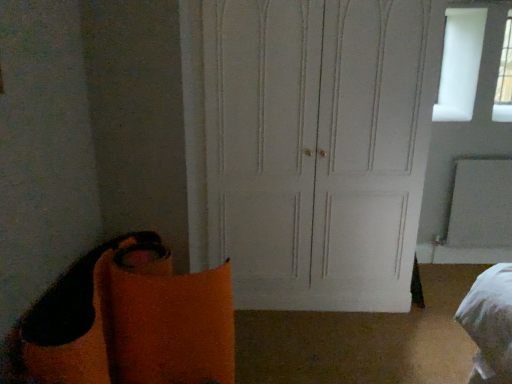
In order to face white matte door at center, should I rotate leftwards or rightwards?

Rotate right and turn 6.808 degrees.

This screenshot has width=512, height=384. Describe the element at coordinates (310, 146) in the screenshot. I see `white matte door at center` at that location.

Locate an element on the screen. The image size is (512, 384). white matte door at center is located at coordinates (310, 146).

Describe the element at coordinates (504, 78) in the screenshot. I see `transparent glass window at upper right` at that location.

I want to click on transparent glass window at upper right, so click(504, 78).

Where is `white matte door at center`? white matte door at center is located at coordinates (310, 146).

Considering the positions of objects white matte door at center and transparent glass window at upper right in the image provided, who is more to the right, white matte door at center or transparent glass window at upper right?

transparent glass window at upper right is more to the right.

Is white matte door at center closer to the viewer compared to transparent glass window at upper right?

Yes, it is.

Is point (420, 30) closer to viewer compared to point (501, 89)?

Yes, it is in front of point (501, 89).

From the image's perspective, which is below, white matte door at center or transparent glass window at upper right?

white matte door at center appears lower in the image.

From a real-world perspective, is white matte door at center physically located above or below transparent glass window at upper right?

In terms of real-world spatial position, white matte door at center is below transparent glass window at upper right.

Does white matte door at center have a lesser width compared to transparent glass window at upper right?

No, white matte door at center is not thinner than transparent glass window at upper right.

Looking at this image, in terms of height, does white matte door at center look taller or shorter compared to transparent glass window at upper right?

white matte door at center is taller than transparent glass window at upper right.

Is white matte door at center bigger than transparent glass window at upper right?

Indeed, white matte door at center has a larger size compared to transparent glass window at upper right.

Can transparent glass window at upper right be found inside white matte door at center?

Definitely not — transparent glass window at upper right is not inside white matte door at center.

Is white matte door at center far away from transparent glass window at upper right?

Yes.

Is white matte door at center oriented towards transparent glass window at upper right?

No, white matte door at center is not aimed at transparent glass window at upper right.

How different are the orientations of white matte door at center and transparent glass window at upper right in degrees?

They differ by 0.805 degrees in their facing directions.

You are a GUI agent. You are given a task and a screenshot of the screen. Output one action in this format:
    pyautogui.click(x=<x>, y=<y>)
    Task: Click on the door in front of the transparent glass window at upper right
    
    Given the screenshot: What is the action you would take?
    pyautogui.click(x=310, y=146)

Looking at this image, considering the positions of objects transparent glass window at upper right and white matte door at center in the image provided, who is more to the left, transparent glass window at upper right or white matte door at center?

white matte door at center.

Which object is more forward, transparent glass window at upper right or white matte door at center?

Positioned in front is white matte door at center.

Considering the positions of points (509, 119) and (375, 188), is point (509, 119) closer to camera compared to point (375, 188)?

That is False.

From the image's perspective, relative to white matte door at center, is transparent glass window at upper right above or below?

transparent glass window at upper right is situated higher than white matte door at center in the image.

From a real-world perspective, relative to white matte door at center, is transparent glass window at upper right vertically above or below?

transparent glass window at upper right is situated higher than white matte door at center in the real world.

Between transparent glass window at upper right and white matte door at center, which one has larger width?

Wider between the two is white matte door at center.

Is transparent glass window at upper right shorter than white matte door at center?

Yes, transparent glass window at upper right is shorter than white matte door at center.

Considering the relative sizes of transparent glass window at upper right and white matte door at center in the image provided, is transparent glass window at upper right smaller than white matte door at center?

Correct, transparent glass window at upper right occupies less space than white matte door at center.

Which is correct: transparent glass window at upper right is inside white matte door at center, or outside of it?

transparent glass window at upper right cannot be found inside white matte door at center.

Is transparent glass window at upper right touching white matte door at center?

They are not placed beside each other.

Is transparent glass window at upper right oriented towards white matte door at center?

No, transparent glass window at upper right does not turn towards white matte door at center.

Consider the image. How many degrees apart are the facing directions of transparent glass window at upper right and white matte door at center?

0.805 degrees separate the facing orientations of transparent glass window at upper right and white matte door at center.

In order to click on window located above the white matte door at center (from a real-world perspective) in this screenshot , I will do click(504, 78).

Locate an element on the screen. door located below the transparent glass window at upper right (from the image's perspective) is located at coordinates coord(310,146).

In order to click on door below the transparent glass window at upper right (from a real-world perspective) in this screenshot , I will do `click(310, 146)`.